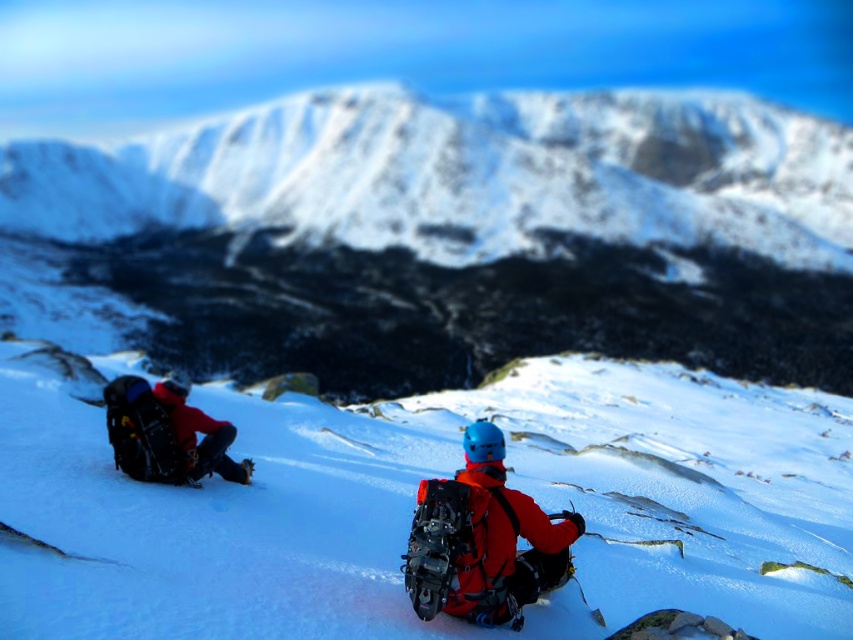
Between snowy mountain at upper center and matte orange jacket at center, which one has less height?

matte orange jacket at center is shorter.

Is snowy mountain at upper center behind matte orange jacket at center?

That is True.

Measure the distance between snowy mountain at upper center and camera.

87.11 meters

Where is `snowy mountain at upper center`? snowy mountain at upper center is located at coordinates (444, 237).

Is point (579, 477) closer to camera compared to point (436, 504)?

No, it is behind (436, 504).

Can you confirm if white powdery snow at center is bigger than matte orange jacket at center?

Yes.

Is point (96, 483) positioned behind point (434, 609)?

That is True.

Where is `white powdery snow at center`? Image resolution: width=853 pixels, height=640 pixels. white powdery snow at center is located at coordinates (413, 502).

Does white powdery snow at center have a larger size compared to matte red jacket at left?

Indeed, white powdery snow at center has a larger size compared to matte red jacket at left.

Which is in front, point (389, 548) or point (181, 381)?

Point (389, 548) is more forward.

Where is `white powdery snow at center`? white powdery snow at center is located at coordinates (413, 502).